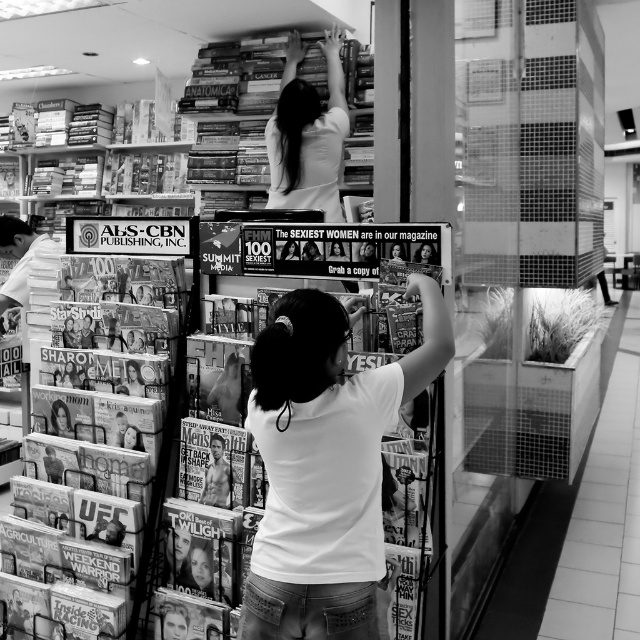
Question: Considering the relative positions of hardcover books at upper left and smooth glossy magazine at center in the image provided, where is hardcover books at upper left located with respect to smooth glossy magazine at center?

Choices:
 (A) right
 (B) left

Answer: (B)

Question: Can you confirm if white matte shirt at center is positioned below hardcover books at upper left?

Choices:
 (A) yes
 (B) no

Answer: (A)

Question: Among these objects, which one is nearest to the camera?

Choices:
 (A) smooth glossy magazine at center
 (B) matte glossy magazines at lower left
 (C) white matte shirt at upper center

Answer: (B)

Question: Can you confirm if white matte shirt at center is positioned to the left of hardcover books at upper left?

Choices:
 (A) no
 (B) yes

Answer: (A)

Question: Which of the following is the farthest from the observer?

Choices:
 (A) hardcover books at upper left
 (B) matte glossy magazines at lower left

Answer: (A)

Question: Which of the following is the farthest from the observer?

Choices:
 (A) click(88, 189)
 (B) click(134, 621)
 (C) click(326, 80)
 (D) click(369, 586)

Answer: (A)